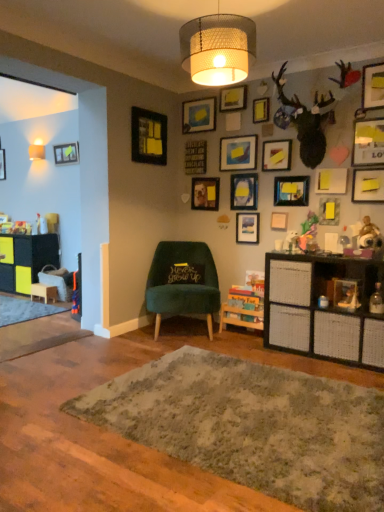
Question: Can you confirm if woven beige lampshade at upper center, the 2th lamp viewed from the back, is smaller than matte white lampshade at upper left, which ranks as the first lamp in left-to-right order?

Choices:
 (A) yes
 (B) no

Answer: (B)

Question: From a real-world perspective, is woven beige lampshade at upper center, the first lamp positioned from the right, on top of matte white lampshade at upper left, which ranks as the first lamp in left-to-right order?

Choices:
 (A) no
 (B) yes

Answer: (B)

Question: Is woven beige lampshade at upper center, acting as the 1th lamp starting from the front, not close to matte white lampshade at upper left, acting as the first lamp starting from the back?

Choices:
 (A) no
 (B) yes

Answer: (B)

Question: Is woven beige lampshade at upper center, acting as the 1th lamp starting from the front, bigger than matte white lampshade at upper left, acting as the first lamp starting from the back?

Choices:
 (A) yes
 (B) no

Answer: (A)

Question: From a real-world perspective, does woven beige lampshade at upper center, the first lamp positioned from the right, sit lower than matte white lampshade at upper left, which ranks as the first lamp in left-to-right order?

Choices:
 (A) yes
 (B) no

Answer: (B)

Question: Is matte white lampshade at upper left, acting as the first lamp starting from the back, inside woven beige lampshade at upper center, acting as the 1th lamp starting from the front?

Choices:
 (A) yes
 (B) no

Answer: (B)

Question: Does yellow matte picture frame at upper right, acting as the 2th picture frame starting from the right, turn towards matte blue picture frame at upper center, arranged as the eighth picture frame when viewed from the left?

Choices:
 (A) yes
 (B) no

Answer: (B)

Question: Does yellow matte picture frame at upper right, the sixteenth picture frame positioned from the left, have a smaller size compared to matte blue picture frame at upper center, arranged as the eighth picture frame when viewed from the left?

Choices:
 (A) no
 (B) yes

Answer: (A)

Question: From the image's perspective, would you say yellow matte picture frame at upper right, acting as the 2th picture frame starting from the right, is positioned over matte blue picture frame at upper center, arranged as the eighth picture frame when viewed from the left?

Choices:
 (A) yes
 (B) no

Answer: (A)

Question: Is yellow matte picture frame at upper right, the sixteenth picture frame positioned from the left, outside of matte blue picture frame at upper center, arranged as the eighth picture frame when viewed from the left?

Choices:
 (A) no
 (B) yes

Answer: (B)

Question: Is matte blue picture frame at upper center, arranged as the tenth picture frame when viewed from the right, at the back of yellow matte picture frame at upper right, the sixteenth picture frame positioned from the left?

Choices:
 (A) yes
 (B) no

Answer: (B)

Question: Does yellow matte picture frame at upper right, acting as the 2th picture frame starting from the right, have a lesser height compared to matte blue picture frame at upper center, arranged as the eighth picture frame when viewed from the left?

Choices:
 (A) yes
 (B) no

Answer: (A)

Question: Considering the relative positions of textured gray rug at center and matte wooden picture frame at center, which is the fourth picture frame in left-to-right order, in the image provided, is textured gray rug at center in front of matte wooden picture frame at center, which is the fourth picture frame in left-to-right order,?

Choices:
 (A) no
 (B) yes

Answer: (B)